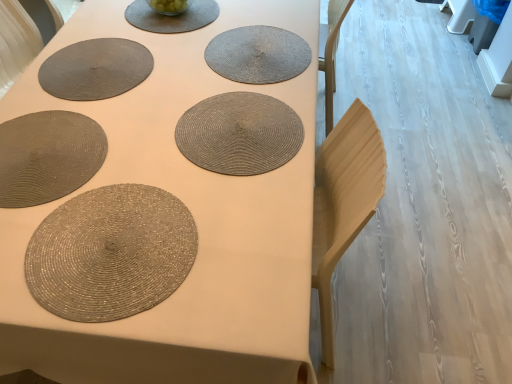
Question: From their relative heights in the image, would you say matte gray placemat at upper center is taller or shorter than matte woven placemat at center?

Choices:
 (A) tall
 (B) short

Answer: (B)

Question: From the image's perspective, is matte gray placemat at upper center located above or below matte woven placemat at center?

Choices:
 (A) above
 (B) below

Answer: (A)

Question: Considering the real-world distances, which object is farthest from the matte gray placemat at upper left, which appears as the 3th paper plate when viewed from the front?

Choices:
 (A) shiny metallic placemat at bottom left, which appears as the third paper plate when viewed from the back
 (B) rattan placemat at center, which appears as the 1th coaster when viewed from the front
 (C) matte woven placemat at center
 (D) matte gray placemat at upper center
 (E) rattan placemat at center, the 1th coaster from the top

Answer: (A)

Question: Estimate the real-world distances between objects in this image. Which object is farther from the matte woven placemat at center?

Choices:
 (A) matte gray placemat at upper center
 (B) rattan placemat at center, the 1th coaster from the top
 (C) shiny metallic placemat at bottom left, which is the first paper plate in front-to-back order
 (D) rattan placemat at center, the first coaster ordered from the bottom
 (E) matte gray placemat at upper left, which appears as the 3th paper plate when viewed from the front

Answer: (A)